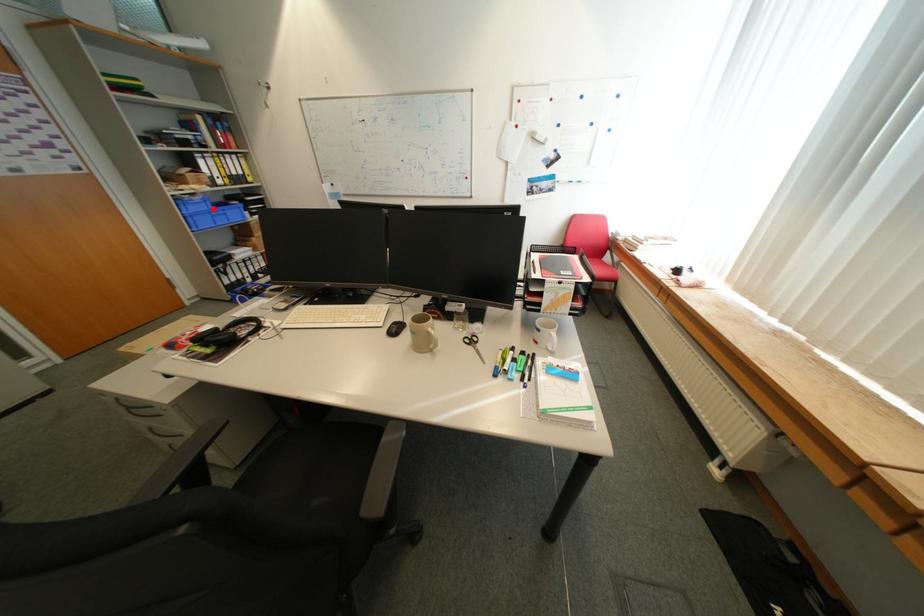
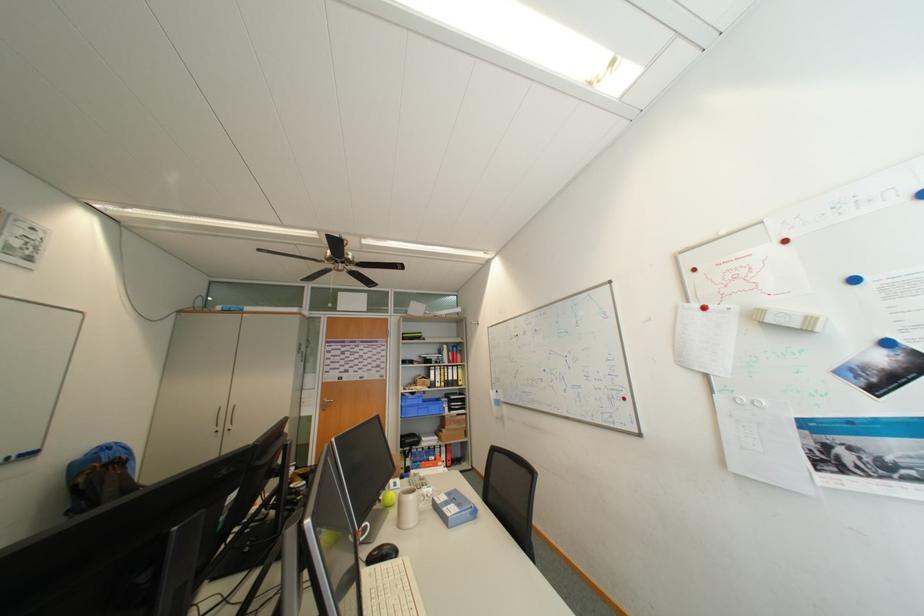
Locate, in the second image, the point that corresponds to the highlighted location in the first image.

(426, 403)